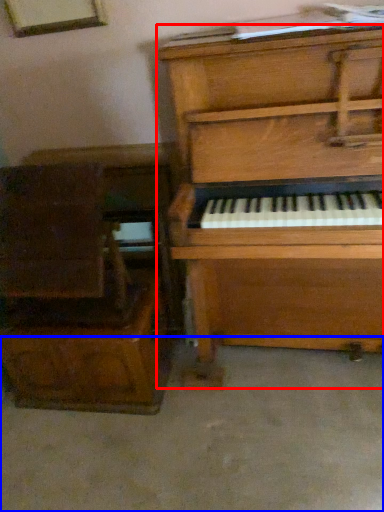
Question: Which of the following is the closest to the observer, piano (highlighted by a red box) or concrete (highlighted by a blue box)?

Choices:
 (A) piano
 (B) concrete

Answer: (A)